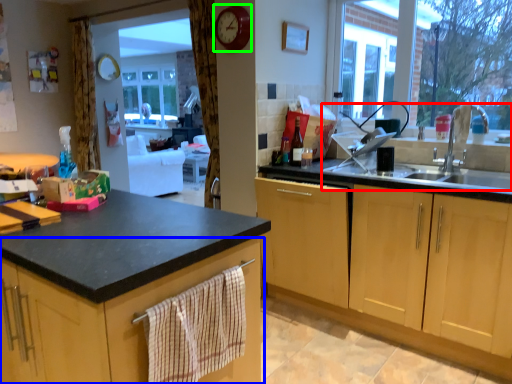
Question: Considering the real-world distances, which object is farthest from sink (highlighted by a red box)? cabinetry (highlighted by a blue box) or clock (highlighted by a green box)?

Choices:
 (A) cabinetry
 (B) clock

Answer: (A)